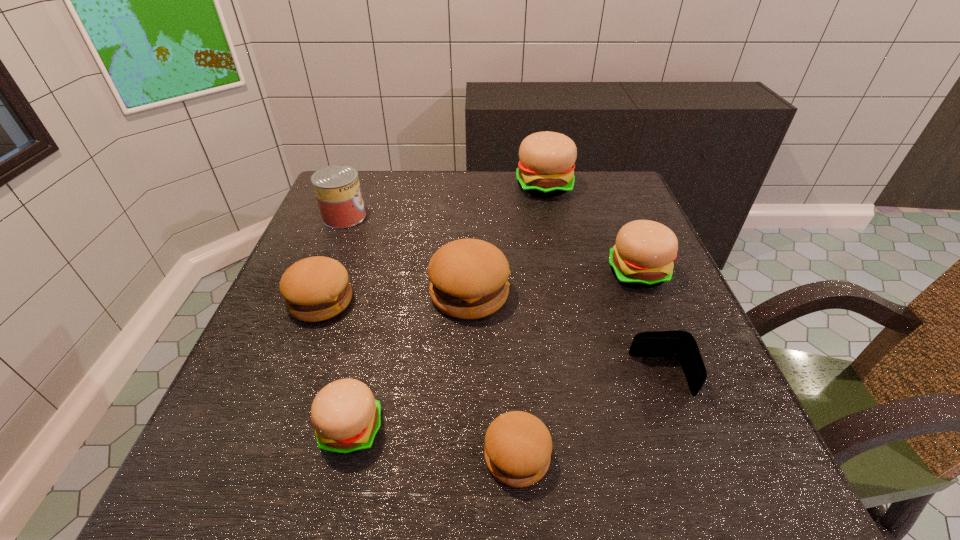
At what (x,y) coordinates should I click in order to perform the action: click on the tallest object. Please return your answer as a coordinate pair (x, y). This screenshot has height=540, width=960. Looking at the image, I should click on (546, 168).

Find the location of `the second beige hamburger from right to left`. the second beige hamburger from right to left is located at coordinates point(546,168).

You are a GUI agent. You are given a task and a screenshot of the screen. Output one action in this format:
    pyautogui.click(x=<x>, y=<y>)
    Task: Click on the second farthest object
    The height and width of the screenshot is (540, 960).
    Given the screenshot: What is the action you would take?
    pyautogui.click(x=337, y=188)

The image size is (960, 540). I want to click on the second smallest beige hamburger, so click(643, 255).

At what (x,y) coordinates should I click in order to perform the action: click on the rightmost beige hamburger. Please return your answer as a coordinate pair (x, y). This screenshot has width=960, height=540. Looking at the image, I should click on (643, 255).

This screenshot has height=540, width=960. In order to click on the biggest brown hamburger in this screenshot , I will do `click(468, 278)`.

Where is `the second biggest brown hamburger`? Image resolution: width=960 pixels, height=540 pixels. the second biggest brown hamburger is located at coordinates (316, 288).

Locate an element on the screen. Image resolution: width=960 pixels, height=540 pixels. the leftmost hamburger is located at coordinates (316, 288).

In order to click on the smallest beige hamburger in this screenshot , I will do `click(346, 416)`.

This screenshot has height=540, width=960. I want to click on the nearest beige hamburger, so click(x=346, y=416).